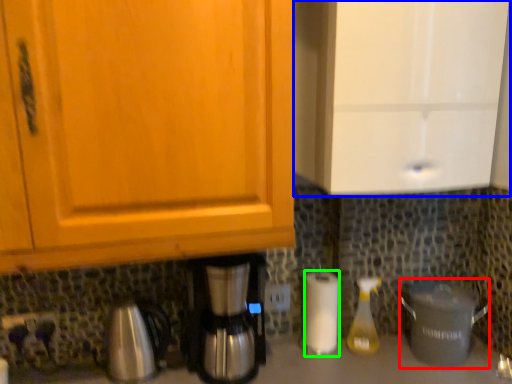
Question: Based on their relative distances, which object is farther from crock pot (highlighted by a red box)? Choose from cabinetry (highlighted by a blue box) and paper towel (highlighted by a green box).

Choices:
 (A) cabinetry
 (B) paper towel

Answer: (A)